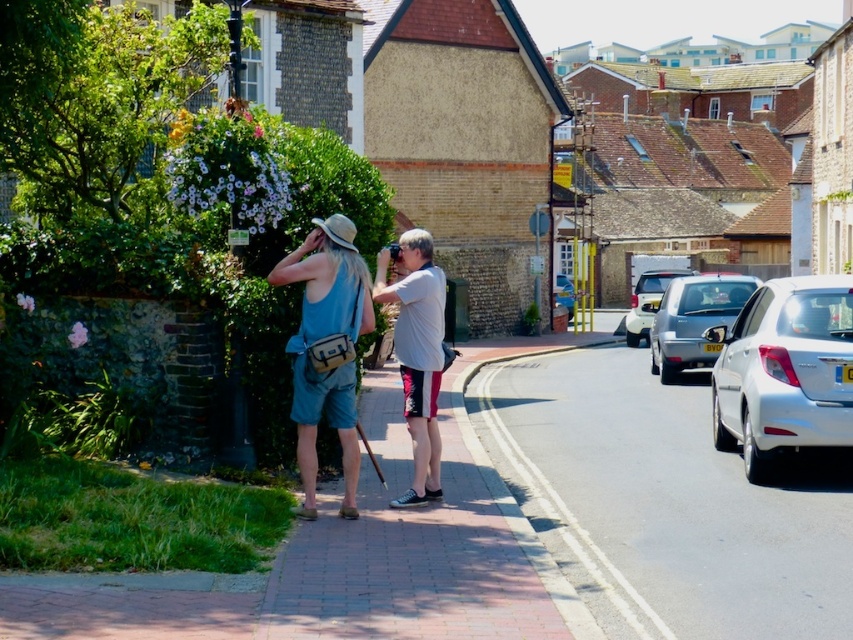
Who is taller, white glossy sedan at right or white glossy sedan at center-right?

white glossy sedan at right is taller.

Measure the distance between white glossy sedan at right and camera.

Answer: white glossy sedan at right and camera are 9.85 meters apart.

Find the location of a particular element. The height and width of the screenshot is (640, 853). white glossy sedan at right is located at coordinates (784, 371).

Between silver metallic sedan at right and white glossy sedan at center-right, which one is positioned higher?

Positioned higher is white glossy sedan at center-right.

Who is more forward, (659, 371) or (569, 280)?

Positioned in front is point (659, 371).

At what (x,y) coordinates should I click in order to perform the action: click on silver metallic sedan at right. Please return your answer as a coordinate pair (x, y). Image resolution: width=853 pixels, height=640 pixels. Looking at the image, I should click on (694, 320).

Is silver metallic sedan at center-right above white glossy sedan at center-right?

Yes.

In the scene shown: Who is positioned more to the right, silver metallic sedan at center-right or white glossy sedan at center-right?

Positioned to the right is silver metallic sedan at center-right.

In order to click on silver metallic sedan at center-right in this screenshot , I will do `click(647, 301)`.

You are a GUI agent. You are given a task and a screenshot of the screen. Output one action in this format:
    pyautogui.click(x=<x>, y=<y>)
    Task: Click on the silver metallic sedan at center-right
    The width and height of the screenshot is (853, 640).
    Given the screenshot: What is the action you would take?
    pyautogui.click(x=647, y=301)